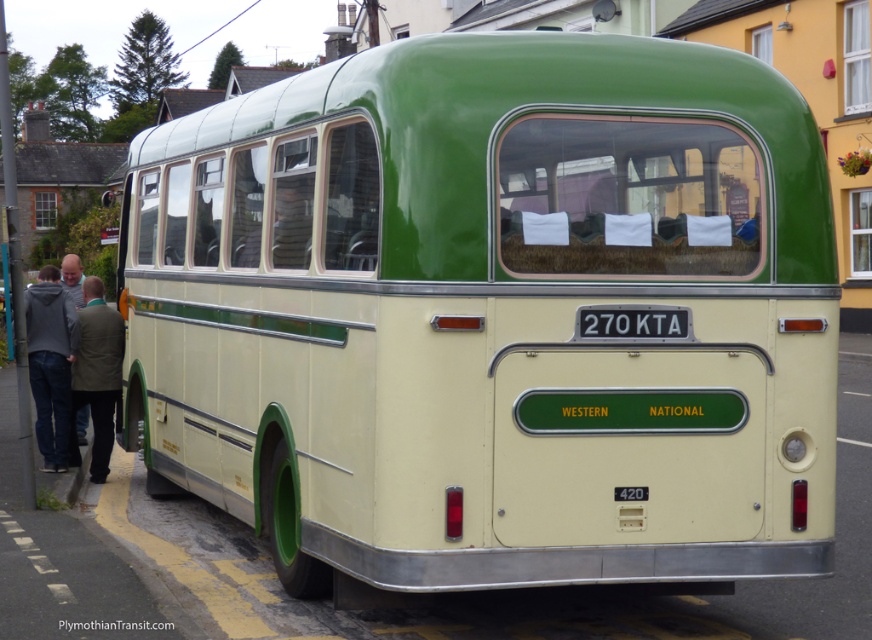
Question: In this image, where is gray hoodie at left located relative to white plastic license plate at center?

Choices:
 (A) left
 (B) right

Answer: (A)

Question: Is gray hoodie at left to the right of white plastic license plate at center from the viewer's perspective?

Choices:
 (A) no
 (B) yes

Answer: (A)

Question: Which object is the closest to the white plastic license plate at center?

Choices:
 (A) gray hoodie at left
 (B) green fabric jacket at left

Answer: (B)

Question: Estimate the real-world distances between objects in this image. Which object is closer to the white plastic license plate at center?

Choices:
 (A) green fabric jacket at left
 (B) gray hoodie at left

Answer: (A)

Question: Does green fabric jacket at left appear under white plastic license plate at center?

Choices:
 (A) yes
 (B) no

Answer: (A)

Question: Which object is positioned farthest from the green fabric jacket at left?

Choices:
 (A) gray hoodie at left
 (B) white plastic license plate at center

Answer: (B)